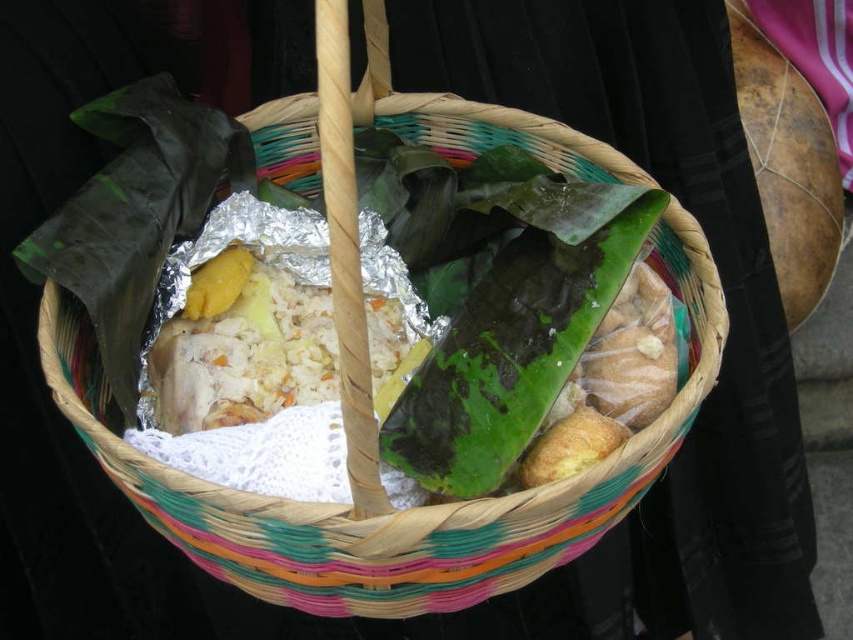
Can you confirm if green matte banana leaf at center is smaller than white rice at center?

Incorrect, green matte banana leaf at center is not smaller in size than white rice at center.

Measure the distance from green matte banana leaf at center to white rice at center.

The distance of green matte banana leaf at center from white rice at center is 6.46 inches.

Find the location of a particular element. Image resolution: width=853 pixels, height=640 pixels. green matte banana leaf at center is located at coordinates (509, 320).